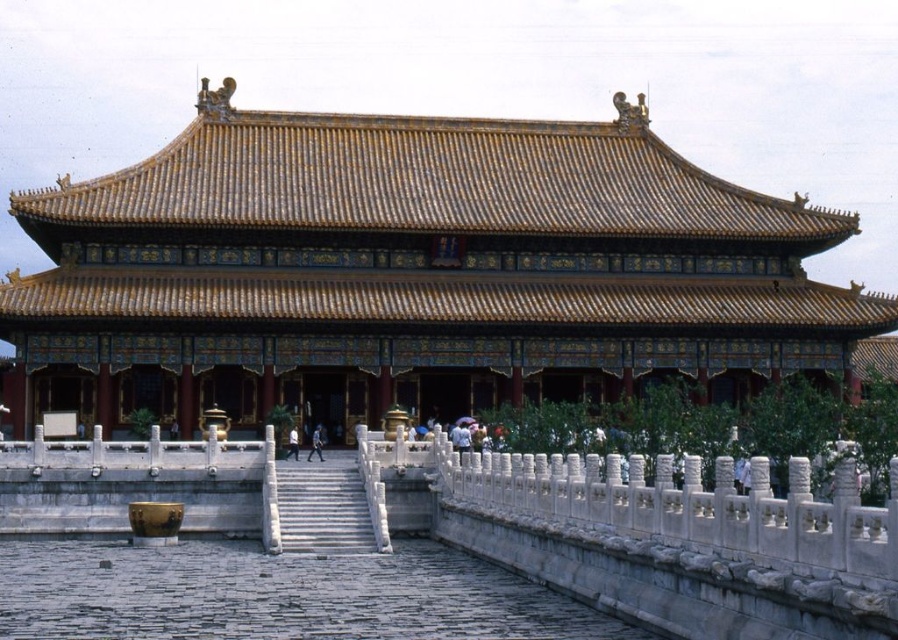
Question: Which of the following is the closest to the observer?

Choices:
 (A) (286, 452)
 (B) (323, 460)

Answer: (B)

Question: Is golden glazed tile palace at center to the left of white marble stairs at center from the viewer's perspective?

Choices:
 (A) no
 (B) yes

Answer: (A)

Question: In this image, where is blue fabric person at center located relative to light blue fabric person at center?

Choices:
 (A) below
 (B) above

Answer: (B)

Question: Which object is positioned closest to the light blue fabric person at center?

Choices:
 (A) golden glazed tile palace at center
 (B) white marble stairs at center
 (C) blue fabric person at center

Answer: (C)

Question: Which point appears closest to the camera in this image?

Choices:
 (A) (315, 451)
 (B) (626, 188)

Answer: (A)

Question: Does golden glazed tile palace at center appear under white marble stairs at center?

Choices:
 (A) yes
 (B) no

Answer: (B)